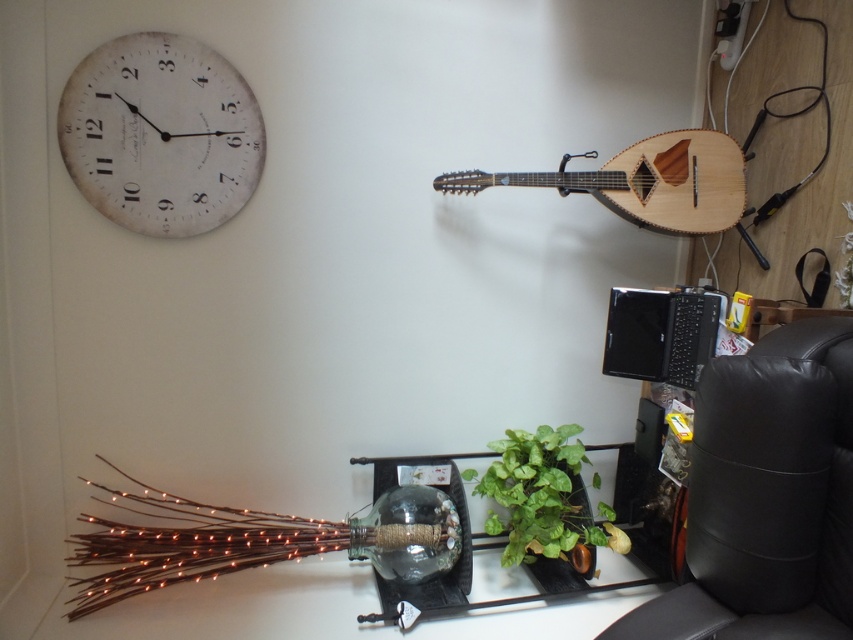
Question: Is black leather armchair at right smaller than white paper clock at upper left?

Choices:
 (A) no
 (B) yes

Answer: (A)

Question: Among these points, which one is nearest to the camera?

Choices:
 (A) pyautogui.click(x=699, y=170)
 (B) pyautogui.click(x=743, y=456)

Answer: (B)

Question: Is black leather armchair at right wider than brown wooden twigs at lower left?

Choices:
 (A) no
 (B) yes

Answer: (A)

Question: Which object is closer to the camera taking this photo?

Choices:
 (A) black leather armchair at right
 (B) transparent glass vase at center
 (C) green leafy plant at center

Answer: (A)

Question: Which point appears closest to the camera in this image?

Choices:
 (A) (395, 589)
 (B) (721, 138)
 (C) (503, 499)
 (D) (734, 611)

Answer: (D)

Question: Can you confirm if black leather armchair at right is wider than white paper clock at upper left?

Choices:
 (A) no
 (B) yes

Answer: (B)